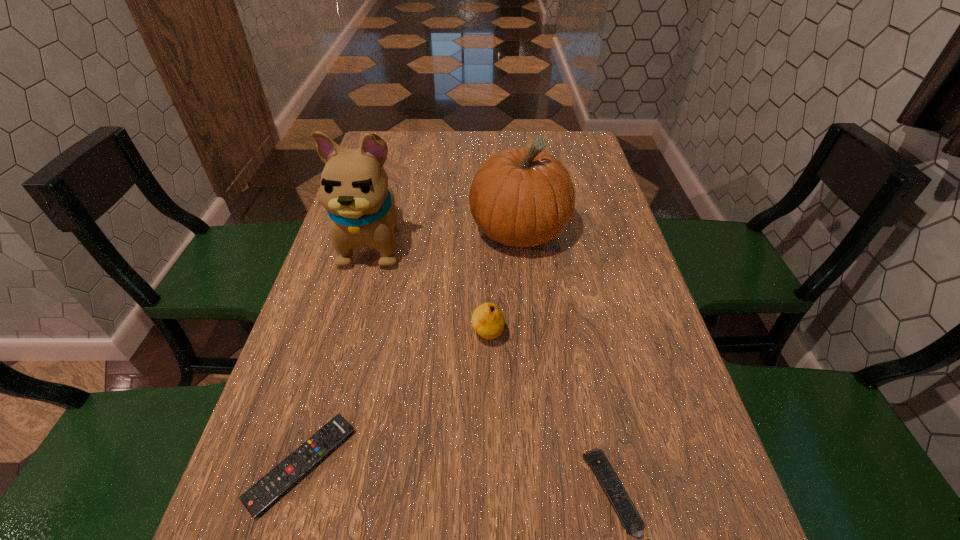
What are the coordinates of `vacant point located on the right of the pear` in the screenshot? It's located at (581, 335).

Locate an element on the screen. This screenshot has height=540, width=960. free location located 0.320m on the back of the fourth tallest object is located at coordinates (574, 308).

Identify the location of vacant region located on the right of the shorter remote control. [x=385, y=464].

You are a GUI agent. You are given a task and a screenshot of the screen. Output one action in this format:
    pyautogui.click(x=<x>, y=<y>)
    Task: Click on the puppy at the left edge
    
    Given the screenshot: What is the action you would take?
    pyautogui.click(x=354, y=190)

At what (x,y) coordinates should I click in order to perform the action: click on remote control located at the left edge. Please return your answer as a coordinate pair (x, y). Looking at the image, I should click on (258, 498).

At what (x,y) coordinates should I click in order to perform the action: click on pumpkin positioned at the right edge. Please return your answer as a coordinate pair (x, y). Image resolution: width=960 pixels, height=540 pixels. Looking at the image, I should click on (520, 197).

The width and height of the screenshot is (960, 540). In order to click on remote control that is at the right edge in this screenshot , I will do `click(632, 522)`.

Locate an element on the screen. The width and height of the screenshot is (960, 540). free space at the far edge of the desktop is located at coordinates (437, 152).

At what (x,y) coordinates should I click in order to perform the action: click on free space at the left edge of the desktop. Please return your answer as a coordinate pair (x, y). The width and height of the screenshot is (960, 540). Looking at the image, I should click on (408, 177).

At what (x,y) coordinates should I click in order to perform the action: click on vacant position at the right edge of the desktop. Please return your answer as a coordinate pair (x, y). Looking at the image, I should click on (601, 221).